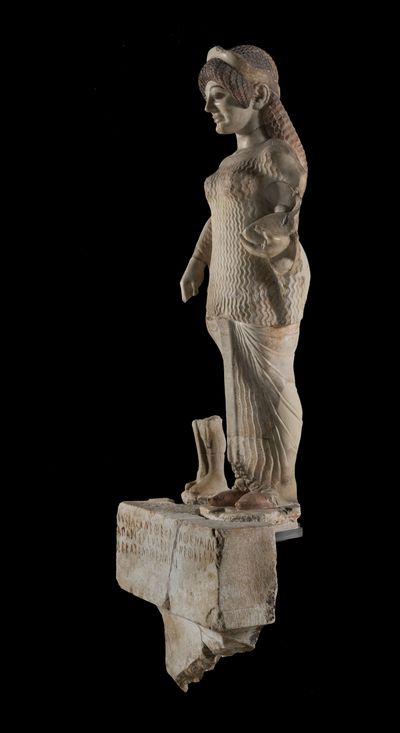
At what (x,y) coordinates should I click in order to perform the action: click on statue. Please return your answer as a coordinate pair (x, y). Image resolution: width=400 pixels, height=733 pixels. Looking at the image, I should click on (242, 273).